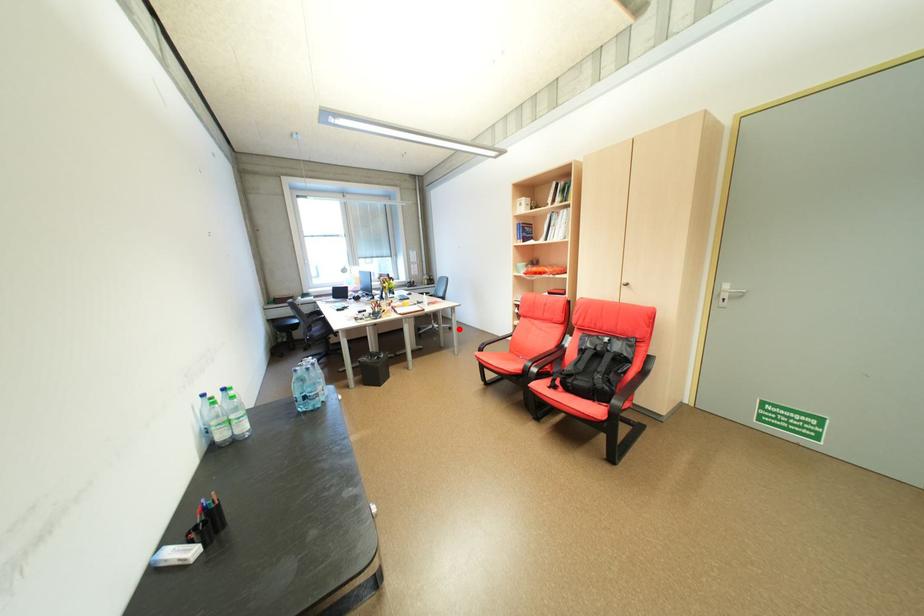
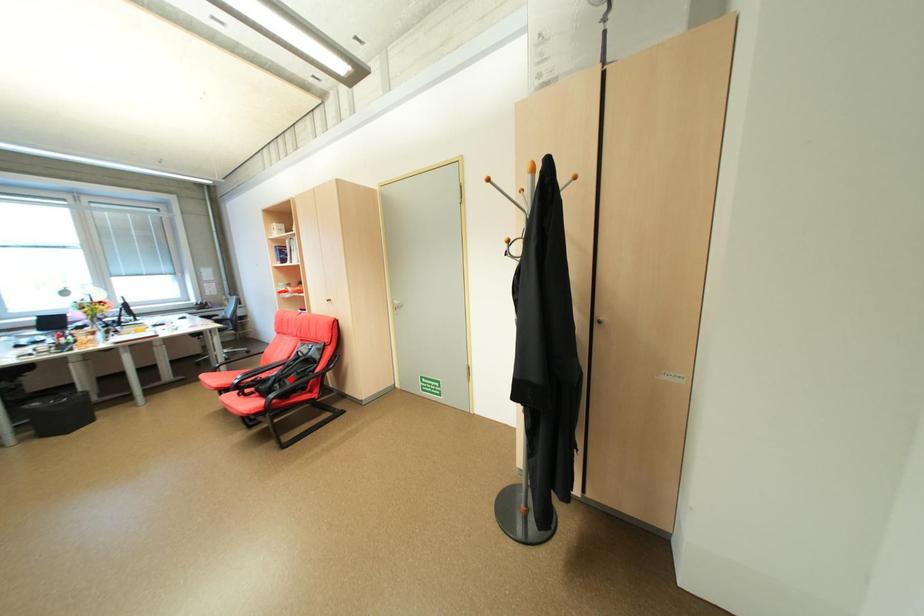
I am providing you with two images of the same scene from different viewpoints. A red point is marked on the first image and another point is marked on the second image. Do the highlighted points in image1 and image2 indicate the same real-world spot?

No